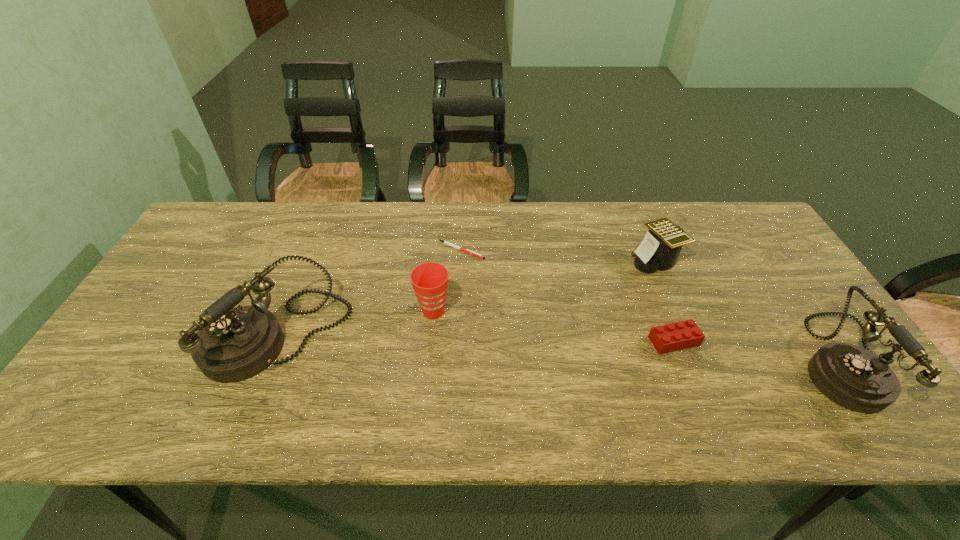
Locate an element on the screen. vacant region at the left edge of the desktop is located at coordinates (217, 275).

Image resolution: width=960 pixels, height=540 pixels. I want to click on vacant space at the far left corner of the desktop, so click(x=198, y=246).

You are a GUI agent. You are given a task and a screenshot of the screen. Output one action in this format:
    pyautogui.click(x=<x>, y=<y>)
    Task: Click on the free space at the far right corner of the desktop
    This screenshot has height=540, width=960.
    Given the screenshot: What is the action you would take?
    [x=727, y=208]

Where is `free space that is in between the shortest object and the fourth tallest object`? The height and width of the screenshot is (540, 960). free space that is in between the shortest object and the fourth tallest object is located at coordinates pos(558,255).

The image size is (960, 540). I want to click on unoccupied position between the rightmost object and the calculator, so click(x=750, y=311).

Find the location of a particular element. empty space that is in between the leftmost object and the shortest object is located at coordinates (370, 294).

You are a GUI agent. You are given a task and a screenshot of the screen. Output one action in this format:
    pyautogui.click(x=<x>, y=<y>)
    Task: Click on the vacant space that's between the tallest object and the shortest object
    This screenshot has width=960, height=540.
    Given the screenshot: What is the action you would take?
    pyautogui.click(x=370, y=294)

At what (x,y) coordinates should I click in order to perform the action: click on blank region between the fourth shortest object and the calculator. Please return your answer as a coordinate pair (x, y). This screenshot has width=960, height=540. Looking at the image, I should click on (544, 286).

Find the location of a particular element. This screenshot has width=960, height=540. free area in between the fourth shortest object and the shorter telephone is located at coordinates (639, 336).

Locate an element on the screen. unoccupied area between the fourth shortest object and the third shortest object is located at coordinates coord(544,286).